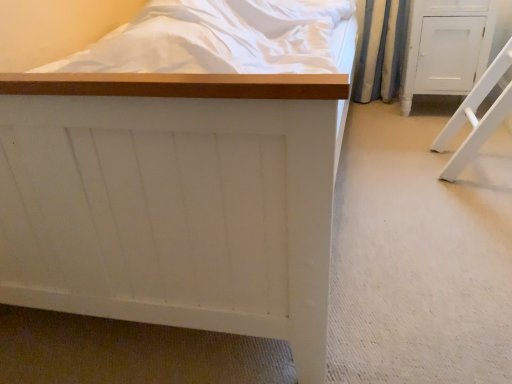
Question: Which direction should I rotate to look at white matte bed at center, which is the first furniture from left to right, — up or down?

Choices:
 (A) down
 (B) up

Answer: (B)

Question: Is white matte bed at center, which appears as the 2th furniture when viewed from the right, to the left of white painted wood cabinet at right, the second furniture positioned from the left, from the viewer's perspective?

Choices:
 (A) yes
 (B) no

Answer: (A)

Question: Does white matte bed at center, which appears as the 2th furniture when viewed from the right, contain white painted wood cabinet at right, the first furniture when ordered from right to left?

Choices:
 (A) no
 (B) yes

Answer: (A)

Question: Can you confirm if white matte bed at center, which appears as the 2th furniture when viewed from the right, is taller than white painted wood cabinet at right, the second furniture positioned from the left?

Choices:
 (A) yes
 (B) no

Answer: (A)

Question: Considering the relative sizes of white matte bed at center, which appears as the 2th furniture when viewed from the right, and white painted wood cabinet at right, the second furniture positioned from the left, in the image provided, is white matte bed at center, which appears as the 2th furniture when viewed from the right, thinner than white painted wood cabinet at right, the second furniture positioned from the left,?

Choices:
 (A) yes
 (B) no

Answer: (B)

Question: Is white matte bed at center, which is the first furniture from left to right, facing towards white painted wood cabinet at right, the second furniture positioned from the left?

Choices:
 (A) no
 (B) yes

Answer: (A)

Question: Is white matte bed at center, which appears as the 2th furniture when viewed from the right, wider than white painted wood cabinet at right, the second furniture positioned from the left?

Choices:
 (A) yes
 (B) no

Answer: (A)

Question: Does white painted wood cabinet at right, the first furniture when ordered from right to left, turn towards white matte bed at center, which appears as the 2th furniture when viewed from the right?

Choices:
 (A) yes
 (B) no

Answer: (B)

Question: Can you confirm if white painted wood cabinet at right, the second furniture positioned from the left, is taller than white matte bed at center, which is the first furniture from left to right?

Choices:
 (A) no
 (B) yes

Answer: (A)

Question: Are white painted wood cabinet at right, the first furniture when ordered from right to left, and white matte bed at center, which is the first furniture from left to right, far apart?

Choices:
 (A) yes
 (B) no

Answer: (A)

Question: Is white painted wood cabinet at right, the first furniture when ordered from right to left, facing away from white matte bed at center, which appears as the 2th furniture when viewed from the right?

Choices:
 (A) no
 (B) yes

Answer: (A)

Question: Is white matte bed at center, which appears as the 2th furniture when viewed from the right, inside white painted wood cabinet at right, the second furniture positioned from the left?

Choices:
 (A) yes
 (B) no

Answer: (B)

Question: Is white painted wood cabinet at right, the first furniture when ordered from right to left, not within white matte bed at center, which appears as the 2th furniture when viewed from the right?

Choices:
 (A) no
 (B) yes

Answer: (B)

Question: Considering the positions of white painted wood cabinet at right, the first furniture when ordered from right to left, and white matte bed at center, which appears as the 2th furniture when viewed from the right, in the image, is white painted wood cabinet at right, the first furniture when ordered from right to left, wider or thinner than white matte bed at center, which appears as the 2th furniture when viewed from the right,?

Choices:
 (A) wide
 (B) thin

Answer: (B)